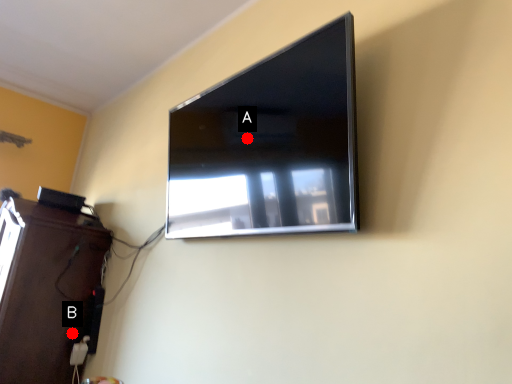
Question: Two points are circled on the image, labeled by A and B beside each circle. Which point is further to the camera?

Choices:
 (A) A is further
 (B) B is further

Answer: (B)